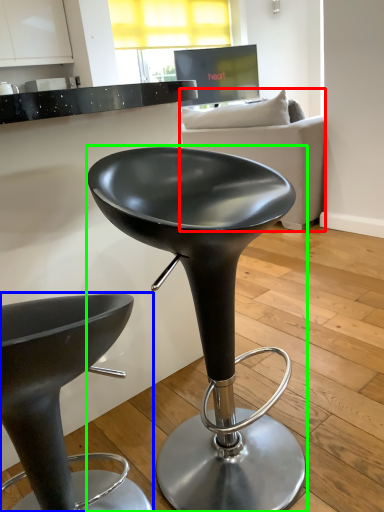
Question: Based on their relative distances, which object is nearer to studio couch (highlighted by a red box)? Choose from stool (highlighted by a blue box) and stool (highlighted by a green box).

Choices:
 (A) stool
 (B) stool

Answer: (B)